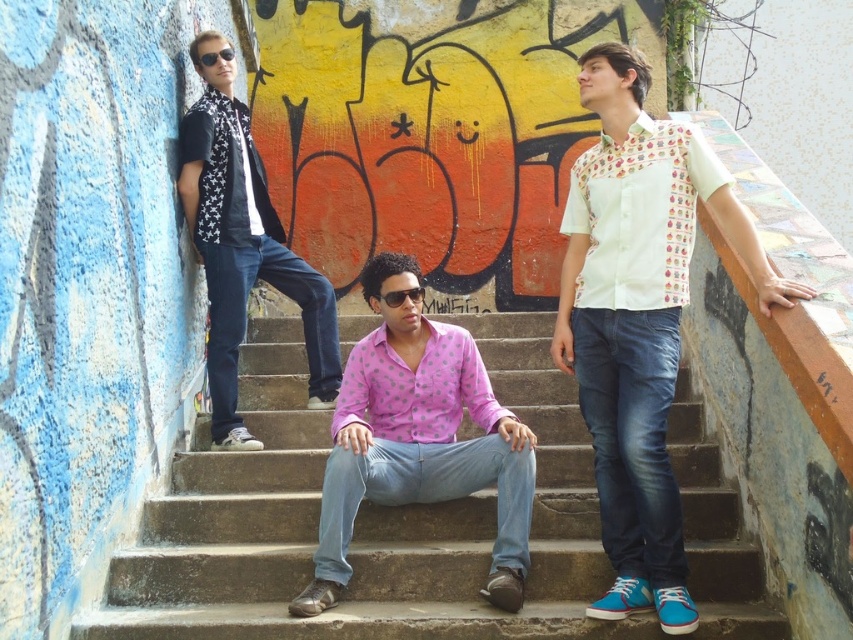
Is point (747, 241) in front of point (367, 365)?

Yes, point (747, 241) is in front of point (367, 365).

Does white printed shirt at right have a lesser width compared to pink dotted shirt at center?

Correct, white printed shirt at right's width is less than pink dotted shirt at center's.

Does point (659, 253) come behind point (473, 387)?

No, it is in front of (473, 387).

Identify the location of white printed shirt at right. (639, 317).

Can you confirm if pink dotted shirt at center is positioned below matte black scarf at left?

Correct, pink dotted shirt at center is located below matte black scarf at left.

Who is more distant from viewer, (416, 292) or (305, 353)?

The point (305, 353) is more distant.

What are the coordinates of `pink dotted shirt at center` in the screenshot? It's located at (418, 436).

Is point (129, 611) farther from camera compared to point (334, 556)?

No, it is not.

Which is below, smooth concrete stairs at center or pink dotted shirt at center?

smooth concrete stairs at center

Is point (277, 481) less distant than point (358, 378)?

No, (277, 481) is behind (358, 378).

You are a GUI agent. You are given a task and a screenshot of the screen. Output one action in this format:
    pyautogui.click(x=<x>, y=<y>)
    Task: Click on the smooth concrete stairs at center
    The height and width of the screenshot is (640, 853).
    Given the screenshot: What is the action you would take?
    pyautogui.click(x=410, y=524)